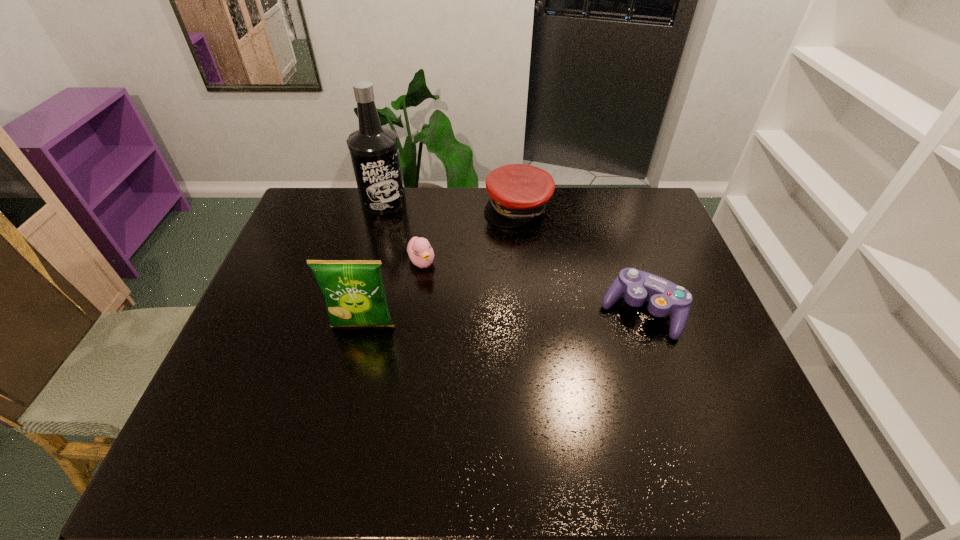
Where is `free spot between the second object from right to left and the liquor`? free spot between the second object from right to left and the liquor is located at coordinates (451, 205).

Find the location of a particular element. The image size is (960, 540). unoccupied area between the second tallest object and the duckling is located at coordinates (392, 294).

Locate an element on the screen. empty location between the liquor and the cap is located at coordinates (451, 205).

Identify the location of free spot between the control and the fourth object from left to right. (580, 260).

This screenshot has height=540, width=960. What are the coordinates of `empty space between the third object from left to right and the liquor` in the screenshot? It's located at (402, 232).

Locate an element on the screen. This screenshot has height=540, width=960. the third closest object to the fourth shortest object is located at coordinates (518, 193).

The width and height of the screenshot is (960, 540). Find the location of `the fourth closest object to the third object from left to right`. the fourth closest object to the third object from left to right is located at coordinates (663, 296).

Locate an element on the screen. The width and height of the screenshot is (960, 540). blank area in the image that satisfies the following two spatial constraints: 1. on the front side of the third object from right to left; 2. on the left side of the tallest object is located at coordinates (368, 262).